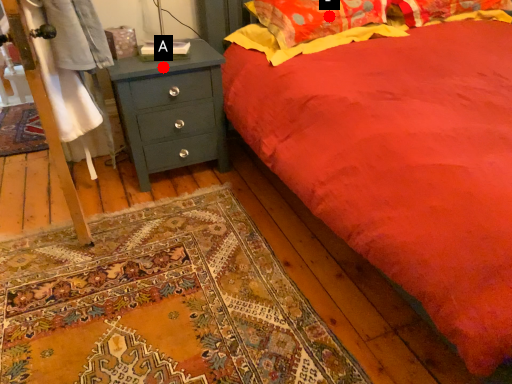
Question: Two points are circled on the image, labeled by A and B beside each circle. Which point appears closest to the camera in this image?

Choices:
 (A) A is closer
 (B) B is closer

Answer: (A)